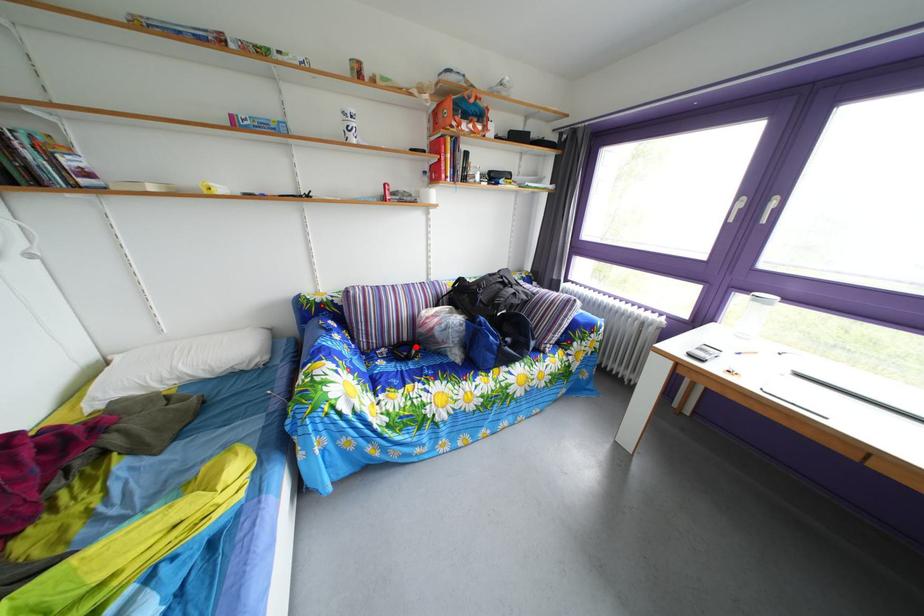
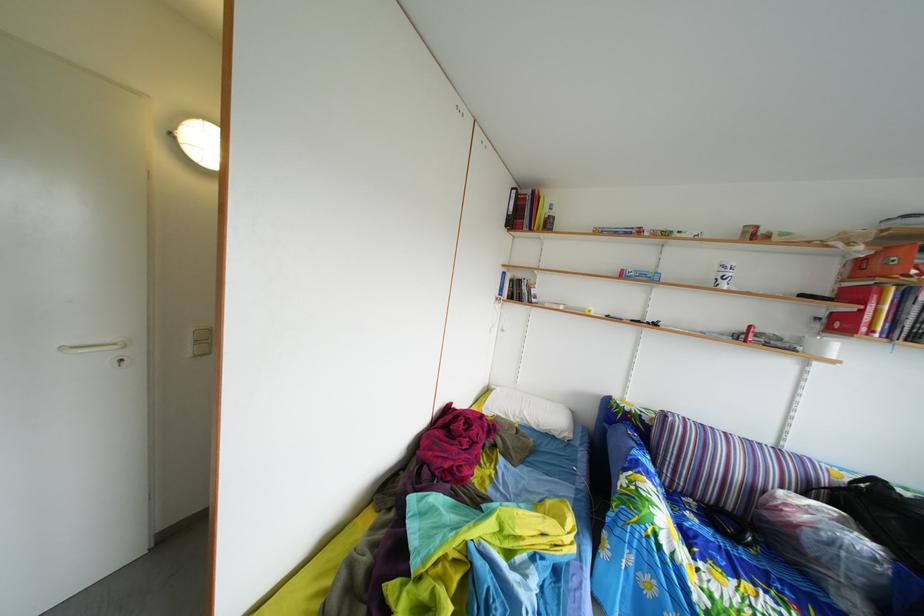
Locate, in the second image, the point that corresponds to the highlighted location in the first image.

(739, 516)